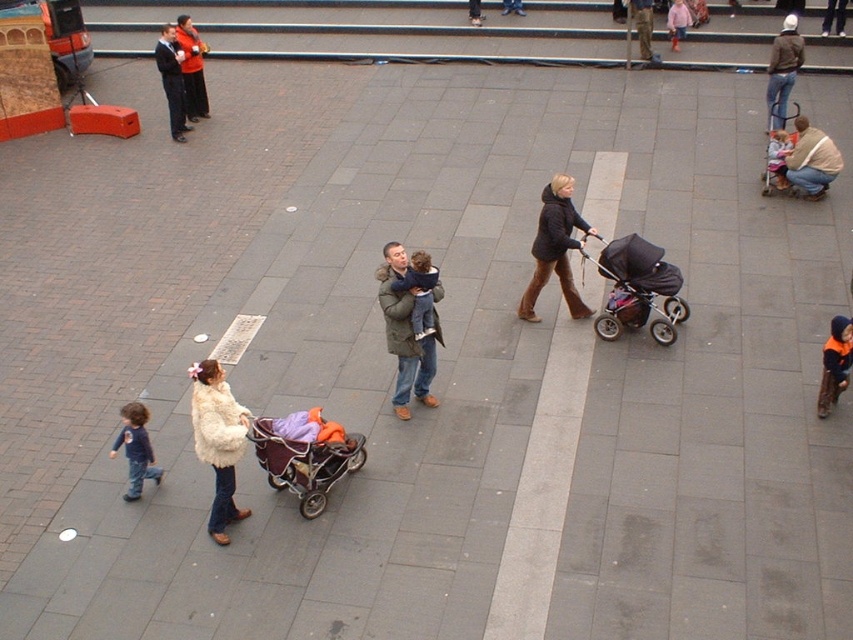
Question: Is black fabric stroller at center positioned at the back of white fur coat at lower left?

Choices:
 (A) no
 (B) yes

Answer: (B)

Question: Which point is farther from the camera taking this photo?

Choices:
 (A) (137, 419)
 (B) (782, 128)
 (C) (187, 60)
 (D) (543, 266)

Answer: (C)

Question: Does black fabric stroller at center have a greater width compared to red sweater at upper left?

Choices:
 (A) no
 (B) yes

Answer: (B)

Question: Which object is closer to the camera taking this photo?

Choices:
 (A) soft blue sweater at center
 (B) fluffy white coat at upper right
 (C) black fabric stroller at center
 (D) velvet purple baby carriage at center

Answer: (D)

Question: Considering the real-world distances, which object is closest to the matte green coat at center?

Choices:
 (A) white fur coat at lower left
 (B) matte black coat at upper left
 (C) orange fleece jacket at lower right

Answer: (A)

Question: Can you confirm if black fabric stroller at center is wider than matte black coat at upper left?

Choices:
 (A) no
 (B) yes

Answer: (B)